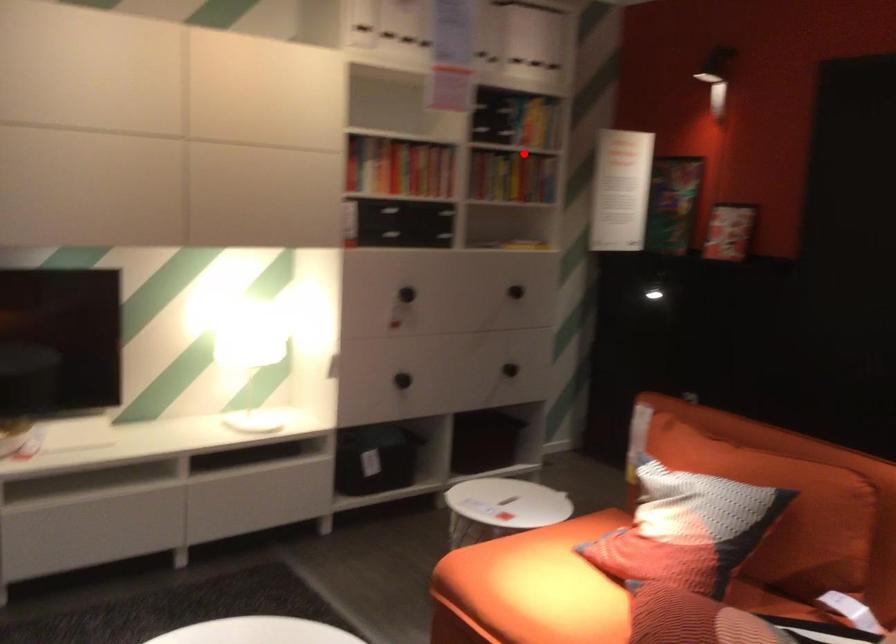
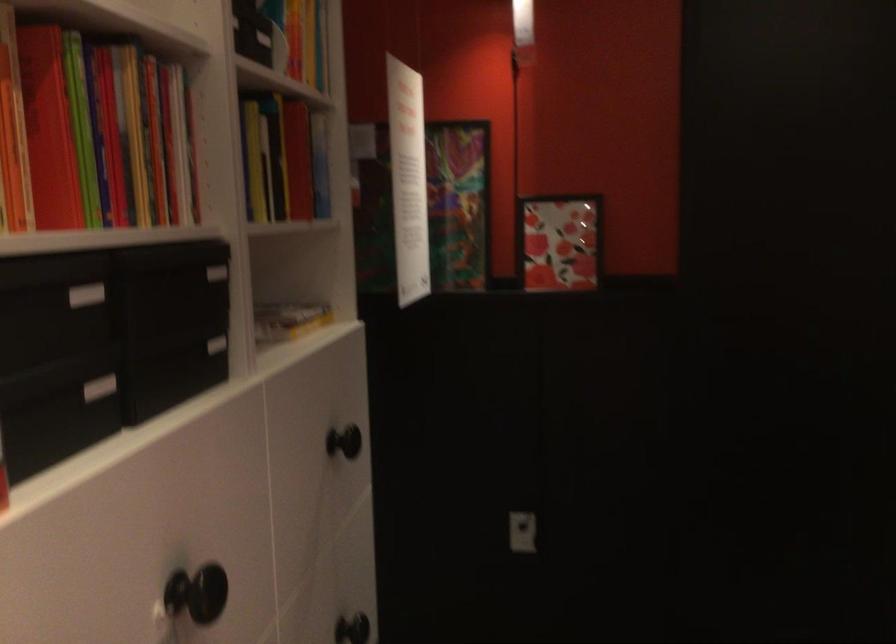
Locate, in the second image, the point that corresponds to the highlighted location in the first image.

(282, 158)